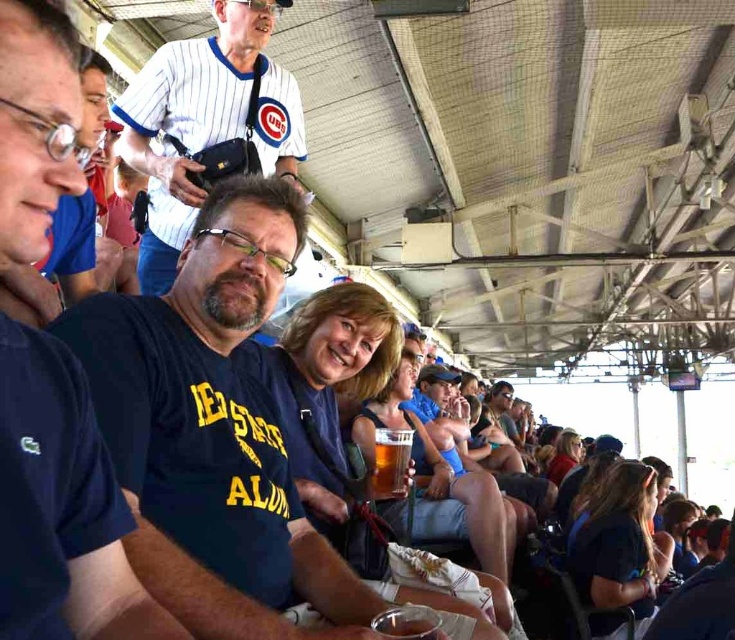
Question: Among these points, which one is farthest from the camera?

Choices:
 (A) (273, 134)
 (B) (395, 474)
 (C) (165, 557)

Answer: (A)

Question: Can you confirm if blue fabric shirt at left is wider than white pinstriped jersey at upper center?

Choices:
 (A) no
 (B) yes

Answer: (A)

Question: Does blue fabric shirt at left appear on the right side of translucent glass at center?

Choices:
 (A) no
 (B) yes

Answer: (A)

Question: In this image, where is blue fabric shirt at left located relative to white pinstriped jersey at upper center?

Choices:
 (A) right
 (B) left

Answer: (A)

Question: Which point is closer to the camera taking this photo?

Choices:
 (A) (137, 355)
 (B) (376, 445)

Answer: (A)

Question: Which point is farther to the camera?

Choices:
 (A) white pinstriped jersey at upper center
 (B) blue fabric shirt at left

Answer: (A)